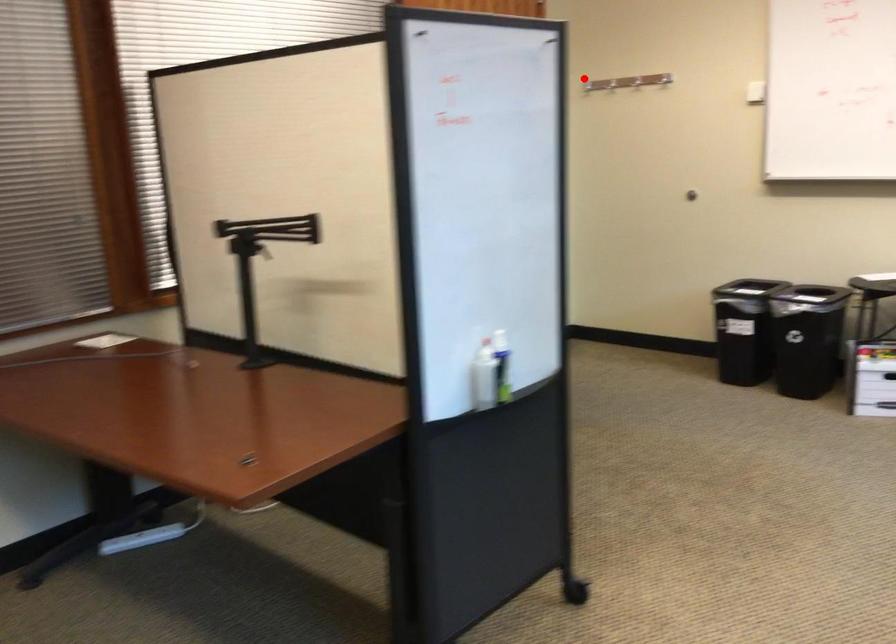
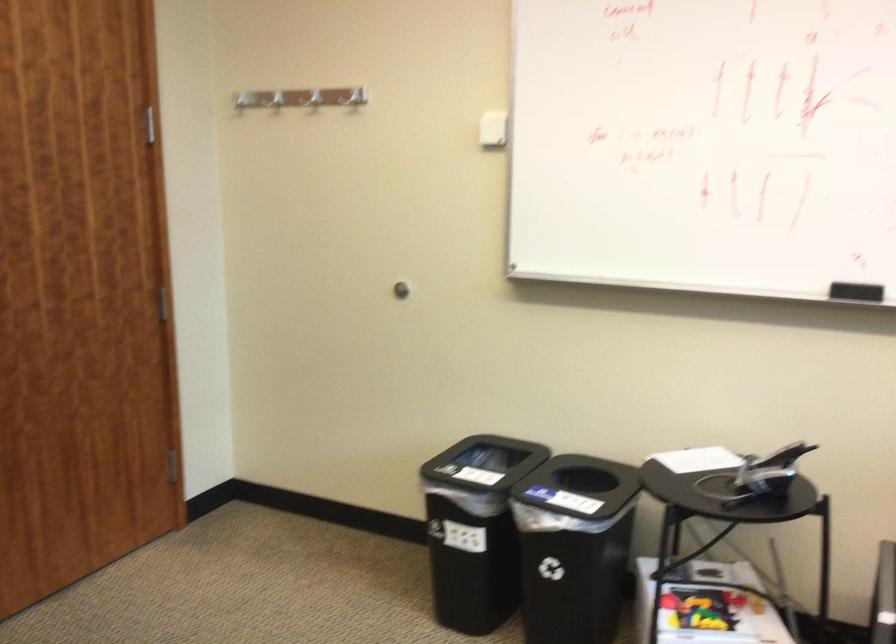
The point at the highlighted location is marked in the first image. Where is the corresponding point in the second image?

(352, 97)